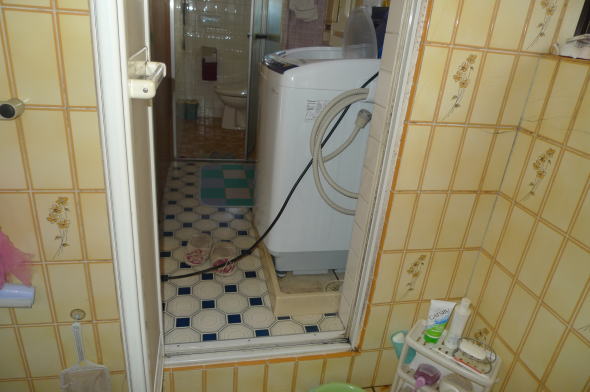
Image resolution: width=590 pixels, height=392 pixels. Find the location of `washing machine`. washing machine is located at coordinates (301, 115).